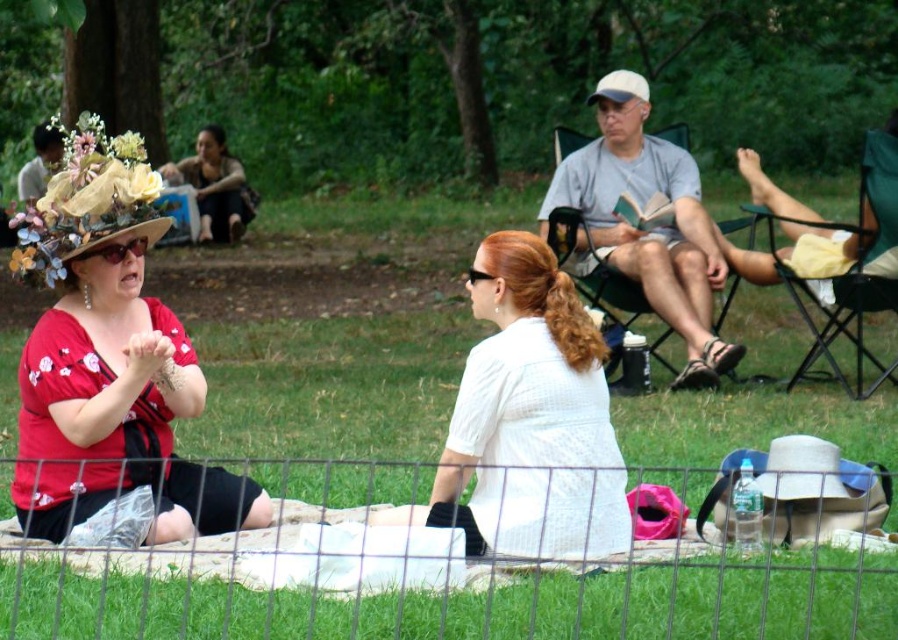
You are a photographer standing in the park and want to take a photo that includes both the gray cotton shirt at center and the matte black dress at upper left. Based on their positions, which object should you focus on first to ensure both are in the frame?

The gray cotton shirt at center is below the matte black dress at upper left, so you should focus on the matte black dress at upper left first to ensure both are in the frame.

You are standing in the park scene and want to take a photo of both the point at coordinates point(527, 342) and point(65, 184). Which point should you focus on first to ensure both are in focus?

You should focus on point(527, 342) first because it is closer to the camera than point(65, 184), allowing the depth of field to cover both points.

You are designing a display stand for a clothing store. The stand has two sections. The first section is for shirts and requires a minimum width of 30 cm. The second section is for hats and needs at least 15 cm. Based on the image, will both items, the white textured shirt at center and the floral fabric hat at upper left, fit in their respective sections?

The white textured shirt at center has a larger width than the floral fabric hat at upper left. Since the shirt section requires a minimum of 30 cm and the hat section needs at least 15 cm, the shirt must be at least 30 cm wide and the hat at least 15 cm. However, without specific measurements, we can only confirm that the shirt is wider than the hat. If the shirt meets the 30 cm requirement, then both can fit. But if the shirt is exactly 30 cm, the hat would be narrower and still fit the 15 cm minimum. The